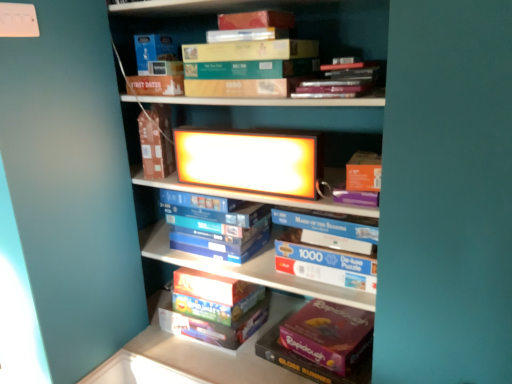
This screenshot has height=384, width=512. Describe the element at coordinates (214, 311) in the screenshot. I see `matte cardboard box at center, which ranks as the fourth book in top-to-bottom order` at that location.

What do you see at coordinates (251, 160) in the screenshot? The width and height of the screenshot is (512, 384). I see `bright yellow plastic lightbox at center` at bounding box center [251, 160].

Describe the element at coordinates (156, 141) in the screenshot. This screenshot has width=512, height=384. I see `matte cardboard book at upper center` at that location.

What do you see at coordinates (340, 81) in the screenshot?
I see `matte cardboard book at upper center, marked as the second book in a top-to-bottom arrangement` at bounding box center [340, 81].

Find the location of a particular element. matte cardboard box at center, which ranks as the fourth book in top-to-bottom order is located at coordinates (214, 311).

Considering the positions of objects matte cardboard box at center, which ranks as the fourth book in top-to-bottom order, and matte green cardboard box at upper center, which is the first book from top to bottom, in the image provided, who is more to the left, matte cardboard box at center, which ranks as the fourth book in top-to-bottom order, or matte green cardboard box at upper center, which is the first book from top to bottom,?

matte cardboard box at center, which ranks as the fourth book in top-to-bottom order, is more to the left.

From a real-world perspective, which is physically above, matte cardboard box at center, which ranks as the 1th book in bottom-to-top order, or matte green cardboard box at upper center, which is the first book from top to bottom?

matte green cardboard box at upper center, which is the first book from top to bottom, from a real-world perspective.

What's the angular difference between matte cardboard box at center, which ranks as the 1th book in bottom-to-top order, and matte green cardboard box at upper center, which is the first book from top to bottom,'s facing directions?

0.0063 degrees.

From the image's perspective, which one is positioned higher, matte cardboard book at upper center or matte green cardboard box at upper center, which is the first book from top to bottom?

matte green cardboard box at upper center, which is the first book from top to bottom, from the image's perspective.

Is matte green cardboard box at upper center, which appears as the 4th book when ordered from the bottom, completely or partially inside matte cardboard book at upper center?

Actually, matte green cardboard box at upper center, which appears as the 4th book when ordered from the bottom, is outside matte cardboard book at upper center.

Measure the distance from matte cardboard book at upper center to matte green cardboard box at upper center, which is the first book from top to bottom.

matte cardboard book at upper center and matte green cardboard box at upper center, which is the first book from top to bottom, are 27.07 inches apart from each other.

Is matte cardboard book at upper center in front of or behind matte green cardboard box at upper center, which appears as the 4th book when ordered from the bottom, in the image?

In the image, matte cardboard book at upper center appears behind matte green cardboard box at upper center, which appears as the 4th book when ordered from the bottom.

Measure the distance from blue cardboard box at center, the second book in the bottom-to-top sequence, to matte cardboard book at upper center, marked as the 3th book in a bottom-to-top arrangement.

The distance of blue cardboard box at center, the second book in the bottom-to-top sequence, from matte cardboard book at upper center, marked as the 3th book in a bottom-to-top arrangement, is 23.00 inches.

Which object is further away from the camera, blue cardboard box at center, the second book in the bottom-to-top sequence, or matte cardboard book at upper center, marked as the second book in a top-to-bottom arrangement?

blue cardboard box at center, the second book in the bottom-to-top sequence.

Is blue cardboard box at center, the second book in the bottom-to-top sequence, shorter than matte cardboard book at upper center, marked as the second book in a top-to-bottom arrangement?

In fact, blue cardboard box at center, the second book in the bottom-to-top sequence, may be taller than matte cardboard book at upper center, marked as the second book in a top-to-bottom arrangement.

From a real-world perspective, which object stands above the other?

matte cardboard book at upper center, marked as the 3th book in a bottom-to-top arrangement.

Considering the positions of objects matte cardboard book at upper center, marked as the second book in a top-to-bottom arrangement, and blue cardboard box at center, which is counted as the 3th book, starting from the top, in the image provided, who is in front, matte cardboard book at upper center, marked as the second book in a top-to-bottom arrangement, or blue cardboard box at center, which is counted as the 3th book, starting from the top,?

Positioned in front is matte cardboard book at upper center, marked as the second book in a top-to-bottom arrangement.

Can we say matte cardboard book at upper center, marked as the 3th book in a bottom-to-top arrangement, lies outside blue cardboard box at center, which is counted as the 3th book, starting from the top?

Yes, matte cardboard book at upper center, marked as the 3th book in a bottom-to-top arrangement, is not within blue cardboard box at center, which is counted as the 3th book, starting from the top.

Considering the relative sizes of matte cardboard book at upper center, marked as the second book in a top-to-bottom arrangement, and blue cardboard box at center, which is counted as the 3th book, starting from the top, in the image provided, is matte cardboard book at upper center, marked as the second book in a top-to-bottom arrangement, wider than blue cardboard box at center, which is counted as the 3th book, starting from the top,?

Yes.

Is matte green cardboard box at upper center, which appears as the 4th book when ordered from the bottom, not near matte cardboard book at upper center, marked as the second book in a top-to-bottom arrangement?

Actually, matte green cardboard box at upper center, which appears as the 4th book when ordered from the bottom, and matte cardboard book at upper center, marked as the second book in a top-to-bottom arrangement, are a little close together.

Is matte green cardboard box at upper center, which is the first book from top to bottom, smaller than matte cardboard book at upper center, marked as the 3th book in a bottom-to-top arrangement?

No, matte green cardboard box at upper center, which is the first book from top to bottom, is not smaller than matte cardboard book at upper center, marked as the 3th book in a bottom-to-top arrangement.

Consider the image. From a real-world perspective, is matte green cardboard box at upper center, which appears as the 4th book when ordered from the bottom, physically located above or below matte cardboard book at upper center, marked as the 3th book in a bottom-to-top arrangement?

From a real-world perspective, matte green cardboard box at upper center, which appears as the 4th book when ordered from the bottom, is physically above matte cardboard book at upper center, marked as the 3th book in a bottom-to-top arrangement.

From a real-world perspective, count 1st books upward from the matte cardboard book at upper center and point to it. Please provide its 2D coordinates.

[(340, 81)]

Relative to matte cardboard book at upper center, is matte cardboard book at upper center, marked as the 3th book in a bottom-to-top arrangement, in front or behind?

Clearly, matte cardboard book at upper center, marked as the 3th book in a bottom-to-top arrangement, is in front of matte cardboard book at upper center.

Is matte cardboard book at upper center, marked as the 3th book in a bottom-to-top arrangement, surrounding matte cardboard book at upper center?

Actually, matte cardboard book at upper center is outside matte cardboard book at upper center, marked as the 3th book in a bottom-to-top arrangement.

Is matte cardboard book at upper center facing away from matte cardboard book at upper center, marked as the second book in a top-to-bottom arrangement?

No, matte cardboard book at upper center, marked as the second book in a top-to-bottom arrangement, is not at the back of matte cardboard book at upper center.

Is matte cardboard book at upper center closer to the viewer compared to matte cardboard book at upper center, marked as the second book in a top-to-bottom arrangement?

No, matte cardboard book at upper center is further to the viewer.

Is point (145, 129) farther from camera compared to point (306, 84)?

Yes, point (145, 129) is behind point (306, 84).

Between matte cardboard book at upper center and matte cardboard book at upper center, marked as the second book in a top-to-bottom arrangement, which one has more height?

With more height is matte cardboard book at upper center.

Locate an element on the screen. The height and width of the screenshot is (384, 512). the 3rd book above the matte cardboard box at center, which ranks as the fourth book in top-to-bottom order (from the image's perspective) is located at coordinates (345, 30).

The width and height of the screenshot is (512, 384). In order to click on paperback book below the matte green cardboard box at upper center, which is the first book from top to bottom (from the image's perspective) in this screenshot , I will do `click(156, 141)`.

Which object lies nearer to the anchor point matte cardboard book at upper center, marked as the second book in a top-to-bottom arrangement, matte cardboard book at upper center or blue cardboard box at center, which is counted as the 3th book, starting from the top?

The object closer to matte cardboard book at upper center, marked as the second book in a top-to-bottom arrangement, is blue cardboard box at center, which is counted as the 3th book, starting from the top.

Considering their positions, is matte cardboard book at upper center, marked as the second book in a top-to-bottom arrangement, positioned closer to blue cardboard box at center, which is counted as the 3th book, starting from the top, than matte green cardboard box at upper center, which is the first book from top to bottom?

Among the two, matte cardboard book at upper center, marked as the second book in a top-to-bottom arrangement, is located nearer to blue cardboard box at center, which is counted as the 3th book, starting from the top.

Based on their spatial positions, is matte cardboard book at upper center, marked as the second book in a top-to-bottom arrangement, or blue cardboard box at center, the second book in the bottom-to-top sequence, further from matte green cardboard box at upper center, which is the first book from top to bottom?

blue cardboard box at center, the second book in the bottom-to-top sequence, lies further to matte green cardboard box at upper center, which is the first book from top to bottom, than the other object.

Considering their positions, is matte cardboard book at upper center, marked as the second book in a top-to-bottom arrangement, positioned further to matte cardboard book at upper center than bright yellow plastic lightbox at center?

Based on the image, matte cardboard book at upper center, marked as the second book in a top-to-bottom arrangement, appears to be further to matte cardboard book at upper center.

From the image, which object appears to be nearer to matte cardboard book at upper center, marked as the second book in a top-to-bottom arrangement, blue cardboard box at center, the second book in the bottom-to-top sequence, or matte cardboard box at center, which ranks as the fourth book in top-to-bottom order?

blue cardboard box at center, the second book in the bottom-to-top sequence, lies closer to matte cardboard book at upper center, marked as the second book in a top-to-bottom arrangement, than the other object.

Based on their spatial positions, is matte cardboard book at upper center or matte cardboard book at upper center, marked as the 3th book in a bottom-to-top arrangement, closer to bright yellow plastic lightbox at center?

The object closer to bright yellow plastic lightbox at center is matte cardboard book at upper center.

When comparing their distances from matte green cardboard box at upper center, which is the first book from top to bottom, does matte cardboard book at upper center, marked as the second book in a top-to-bottom arrangement, or bright yellow plastic lightbox at center seem further?

bright yellow plastic lightbox at center lies further to matte green cardboard box at upper center, which is the first book from top to bottom, than the other object.

Consider the image. When comparing their distances from matte cardboard book at upper center, does matte green cardboard box at upper center, which appears as the 4th book when ordered from the bottom, or bright yellow plastic lightbox at center seem closer?

bright yellow plastic lightbox at center lies closer to matte cardboard book at upper center than the other object.

Where is `book cover between matte cardboard book at upper center and matte cardboard book at upper center, marked as the 3th book in a bottom-to-top arrangement, from left to right`? The image size is (512, 384). book cover between matte cardboard book at upper center and matte cardboard book at upper center, marked as the 3th book in a bottom-to-top arrangement, from left to right is located at coordinates (251, 160).

Locate an element on the screen. book between matte cardboard book at upper center, marked as the second book in a top-to-bottom arrangement, and matte cardboard box at center, which ranks as the 1th book in bottom-to-top order, in the up-down direction is located at coordinates (216, 225).

At what (x,y) coordinates should I click in order to perform the action: click on paperback book between matte cardboard book at upper center, marked as the 3th book in a bottom-to-top arrangement, and matte cardboard box at center, which ranks as the 1th book in bottom-to-top order, in the up-down direction. Please return your answer as a coordinate pair (x, y). Image resolution: width=512 pixels, height=384 pixels. Looking at the image, I should click on pyautogui.click(x=156, y=141).

The width and height of the screenshot is (512, 384). Find the location of `paperback book between matte green cardboard box at upper center, which appears as the 4th book when ordered from the bottom, and blue cardboard box at center, the second book in the bottom-to-top sequence, vertically`. paperback book between matte green cardboard box at upper center, which appears as the 4th book when ordered from the bottom, and blue cardboard box at center, the second book in the bottom-to-top sequence, vertically is located at coordinates (156, 141).